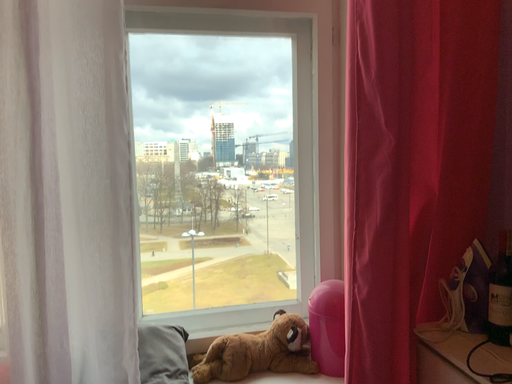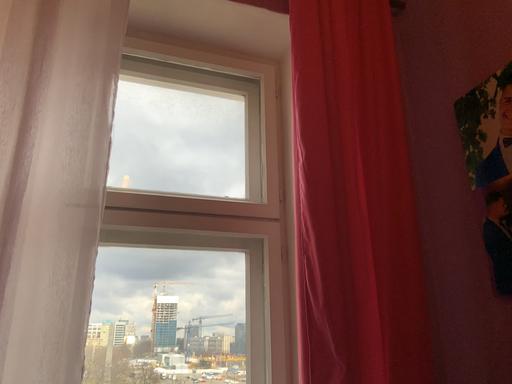
Question: How did the camera likely rotate when shooting the video?

Choices:
 (A) rotated upward
 (B) rotated downward

Answer: (A)